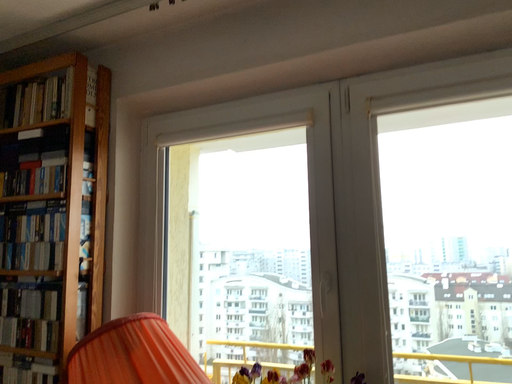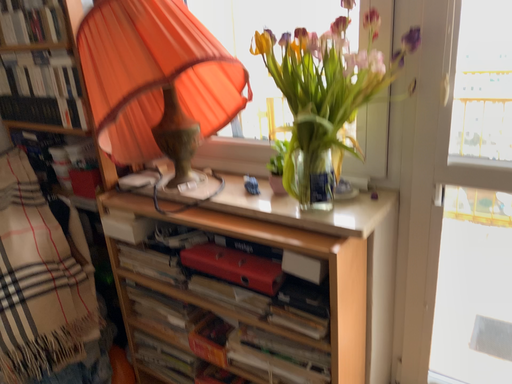
Question: Which way did the camera rotate in the video?

Choices:
 (A) rotated downward
 (B) rotated upward

Answer: (A)